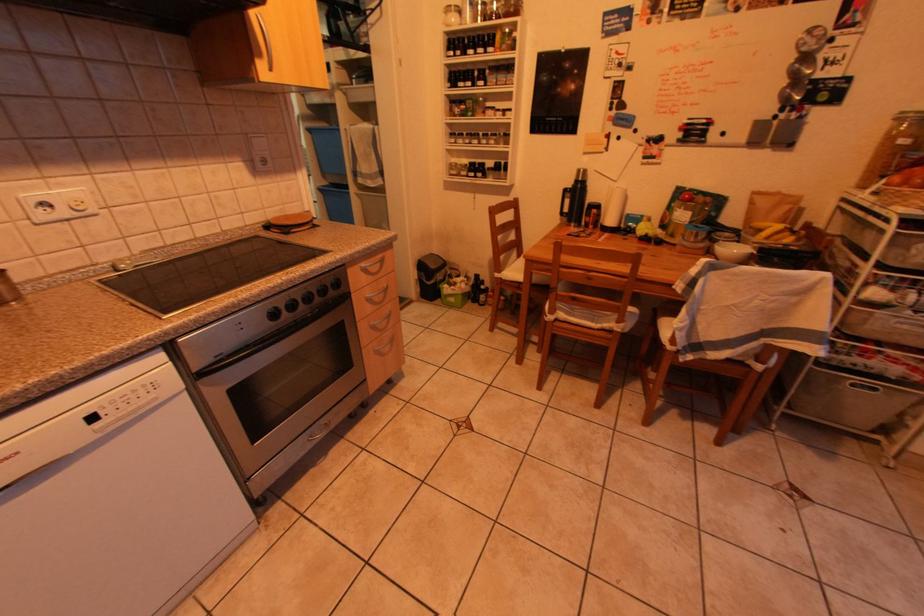
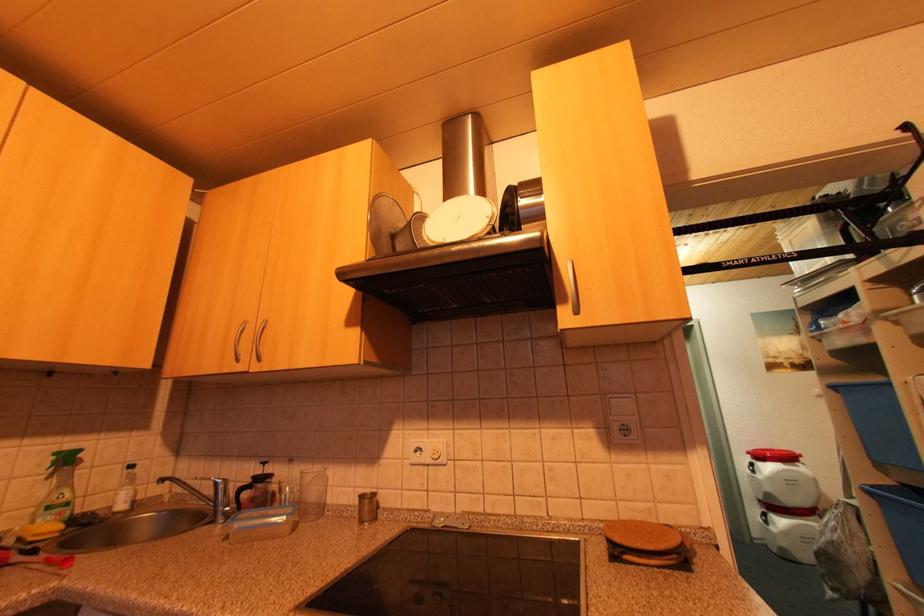
In the scene shown: The first image is from the beginning of the video and the second image is from the end. How did the camera likely rotate when shooting the video?

The camera's rotation is toward left-up.